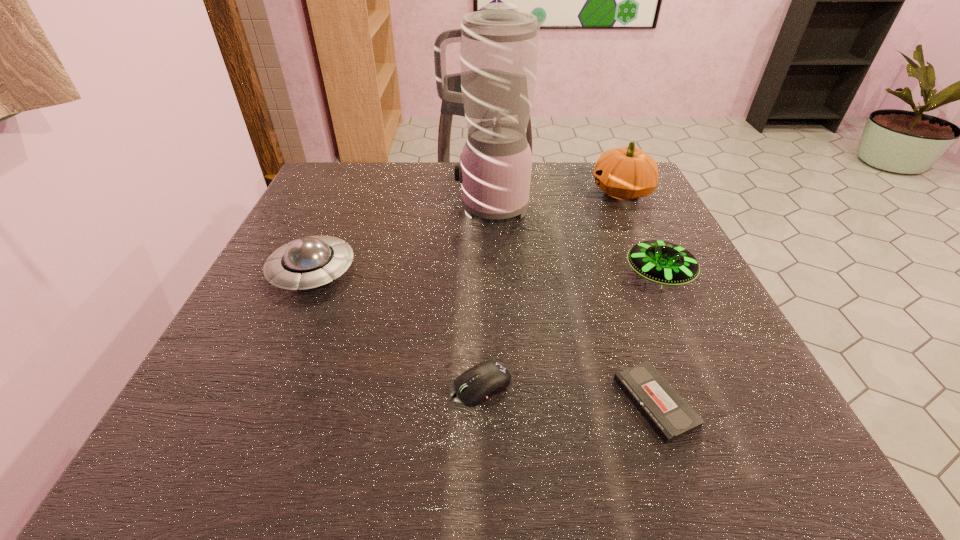
The image size is (960, 540). I want to click on free spot located on the side of the fifth shortest object with the carved face, so click(x=524, y=191).

At what (x,y) coordinates should I click in order to perform the action: click on free space located 0.180m on the side of the fifth shortest object with the carved face. Please return your answer as a coordinate pair (x, y). The width and height of the screenshot is (960, 540). Looking at the image, I should click on (516, 191).

The width and height of the screenshot is (960, 540). I want to click on vacant area located 0.140m on the right of the leftmost object, so click(428, 272).

This screenshot has width=960, height=540. I want to click on vacant space located on the left of the right saucer, so click(x=588, y=275).

At what (x,y) coordinates should I click in order to perform the action: click on free location located 0.090m on the right of the computer equipment. Please return your answer as a coordinate pair (x, y). Looking at the image, I should click on (573, 386).

This screenshot has width=960, height=540. Find the location of `vacant space located on the back of the videotape`. vacant space located on the back of the videotape is located at coordinates (625, 314).

This screenshot has height=540, width=960. In order to click on food processor that is at the far edge in this screenshot , I will do `click(499, 45)`.

Find the location of a particular element. The width and height of the screenshot is (960, 540). gourd present at the far edge is located at coordinates (625, 173).

I want to click on computer equipment that is at the near edge, so click(475, 385).

I want to click on videotape that is at the near edge, so click(669, 414).